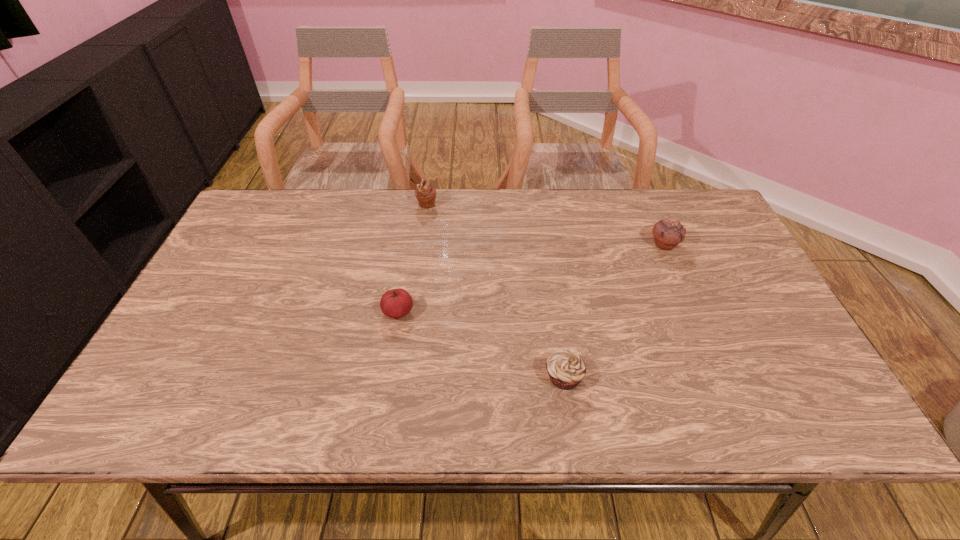
I want to click on vacant space located on the left of the shortest muffin, so click(x=392, y=377).

Find the location of a particular element. The width and height of the screenshot is (960, 540). object that is at the near edge is located at coordinates (566, 369).

The image size is (960, 540). Identify the location of object at the right edge. click(x=667, y=233).

In order to click on object present at the far right corner in this screenshot , I will do `click(667, 233)`.

In the image, there is a desktop. Where is `vacant area at the far edge`? This screenshot has height=540, width=960. vacant area at the far edge is located at coordinates (502, 210).

Find the location of `blank space at the near edge`. blank space at the near edge is located at coordinates (511, 415).

In the image, there is a desktop. Where is `free region at the left edge`? The height and width of the screenshot is (540, 960). free region at the left edge is located at coordinates (209, 319).

In the image, there is a desktop. In order to click on vacant space at the right edge in this screenshot , I will do `click(712, 312)`.

In the image, there is a desktop. Identify the location of free space at the far left corner. This screenshot has width=960, height=540. (260, 194).

You are a GUI agent. You are given a task and a screenshot of the screen. Output one action in this format:
    pyautogui.click(x=<x>, y=<y>)
    Task: Click on the free space at the near left corner
    
    Given the screenshot: What is the action you would take?
    pyautogui.click(x=128, y=411)